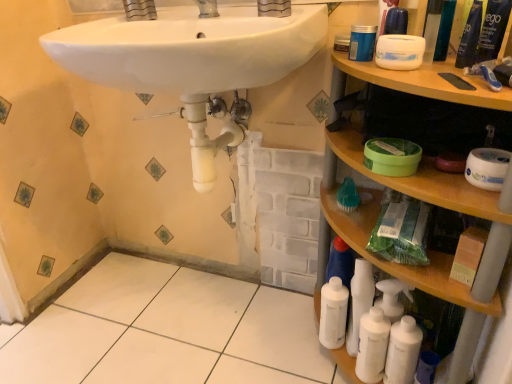
At what (x,y) coordinates should I click in order to perform the action: click on vacant space situated on the left part of matte silver faucet at upper center. Please return your answer as a coordinate pair (x, y). Looking at the image, I should click on (224, 18).